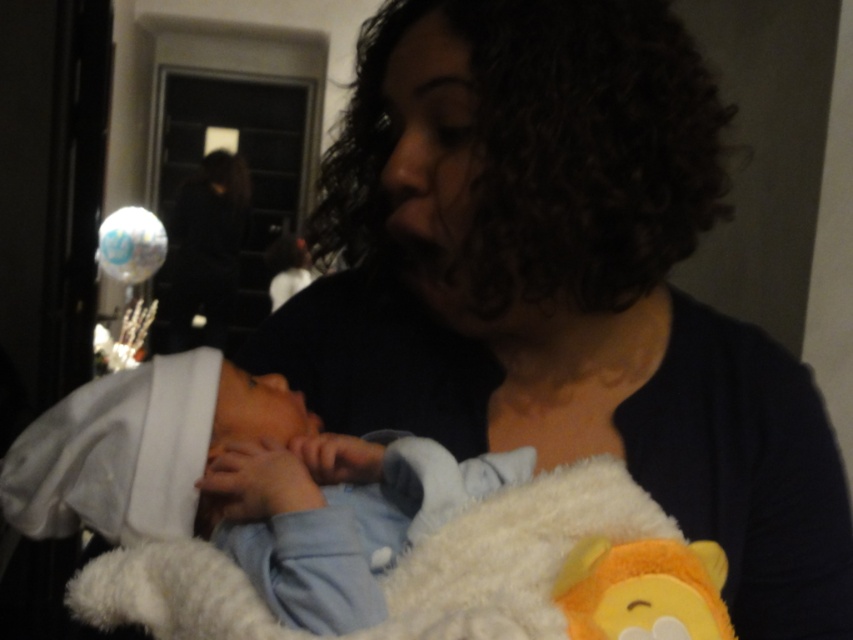
Question: Does white soft blanket at center come in front of fluffy yellow bear at lower center?

Choices:
 (A) yes
 (B) no

Answer: (B)

Question: Is white soft blanket at center to the left of fluffy yellow bear at lower center from the viewer's perspective?

Choices:
 (A) no
 (B) yes

Answer: (B)

Question: Does white soft blanket at center come behind fluffy yellow bear at lower center?

Choices:
 (A) no
 (B) yes

Answer: (B)

Question: Which point is closer to the camera?

Choices:
 (A) (717, 556)
 (B) (196, 464)

Answer: (A)